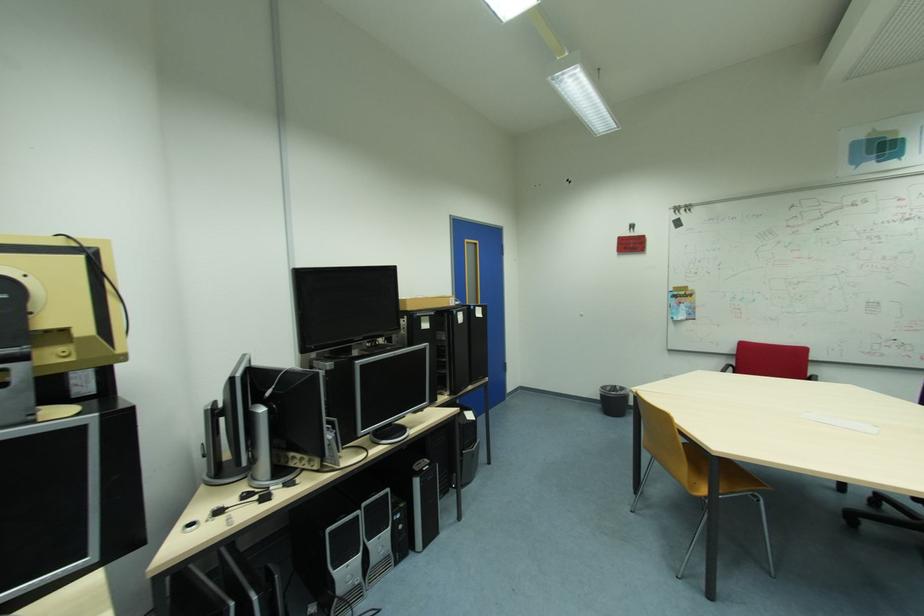
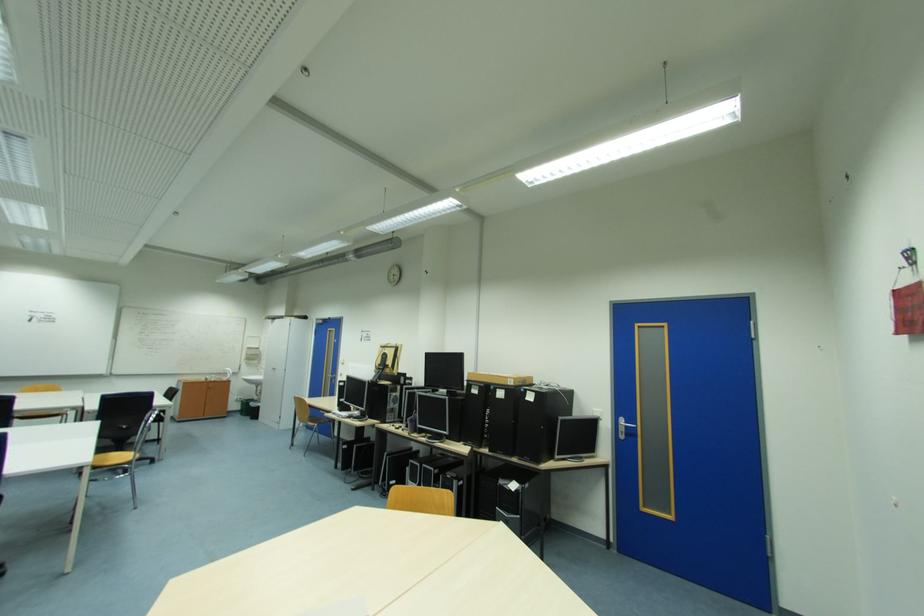
Locate, in the second image, the point that corresponds to pixel 457 302 in the first image.

(517, 382)